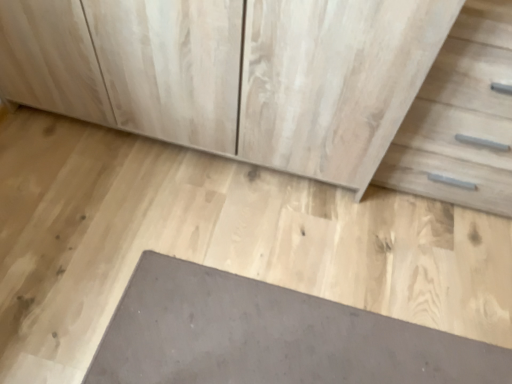
What do you see at coordinates (270, 336) in the screenshot?
I see `slate at lower center` at bounding box center [270, 336].

This screenshot has width=512, height=384. Find the location of `light wood drawer at right`. light wood drawer at right is located at coordinates (461, 117).

Does gray concrete at center have a lesser height compared to light wood drawer at right?

Yes.

Do you think gray concrete at center is within light wood drawer at right, or outside of it?

gray concrete at center exists outside the volume of light wood drawer at right.

Does gray concrete at center appear on the left side of light wood drawer at right?

Correct, you'll find gray concrete at center to the left of light wood drawer at right.

Is light wood drawer at right with slate at lower center?

light wood drawer at right and slate at lower center are not in contact.

Is light wood drawer at right facing towards slate at lower center?

Yes, light wood drawer at right is oriented towards slate at lower center.

Based on the photo, from the image's perspective, who appears lower, light wood drawer at right or slate at lower center?

slate at lower center appears lower in the image.

Is light wood cabinet at center inside slate at lower center?

No, slate at lower center does not contain light wood cabinet at center.

Considering the positions of objects slate at lower center and light wood cabinet at center in the image provided, who is more to the right, slate at lower center or light wood cabinet at center?

From the viewer's perspective, slate at lower center appears more on the right side.

Where is `slate below the light wood cabinet at center (from the image's perspective)`? The image size is (512, 384). slate below the light wood cabinet at center (from the image's perspective) is located at coordinates (270, 336).

From the picture: From a real-world perspective, is slate at lower center beneath light wood cabinet at center?

Yes.

Considering the relative positions of light wood cabinet at center and light wood drawer at right in the image provided, is light wood cabinet at center to the right of light wood drawer at right from the viewer's perspective?

No.

How far apart are light wood cabinet at center and light wood drawer at right?

They are 16.60 inches apart.

Considering the relative sizes of light wood cabinet at center and light wood drawer at right in the image provided, is light wood cabinet at center shorter than light wood drawer at right?

Yes.

From the image's perspective, who appears lower, light wood cabinet at center or light wood drawer at right?

light wood drawer at right.

Considering the relative sizes of gray concrete at center and light wood cabinet at center in the image provided, is gray concrete at center smaller than light wood cabinet at center?

Indeed, gray concrete at center has a smaller size compared to light wood cabinet at center.

Based on the photo, from the image's perspective, is gray concrete at center located above or below light wood cabinet at center?

gray concrete at center is situated lower than light wood cabinet at center in the image.

Is the position of gray concrete at center more distant than that of light wood cabinet at center?

Yes.

Is light wood drawer at right beside light wood cabinet at center?

light wood drawer at right is not next to light wood cabinet at center, and they're not touching.

Does light wood drawer at right turn towards light wood cabinet at center?

No, light wood drawer at right is not oriented towards light wood cabinet at center.

Is light wood drawer at right at the left side of light wood cabinet at center?

No.

From the image's perspective, is light wood drawer at right on top of light wood cabinet at center?

No, from the image's perspective, light wood drawer at right is not above light wood cabinet at center.

Who is taller, light wood drawer at right or gray concrete at center?

light wood drawer at right.

Is light wood drawer at right bigger than gray concrete at center?

Yes.

Would you consider light wood drawer at right to be distant from gray concrete at center?

No, light wood drawer at right is in close proximity to gray concrete at center.

Is light wood drawer at right to the left or to the right of gray concrete at center in the image?

In the image, light wood drawer at right appears on the right side of gray concrete at center.

This screenshot has width=512, height=384. I want to click on concrete below the light wood drawer at right (from the image's perspective), so click(x=216, y=240).

In order to click on slate behind the light wood drawer at right in this screenshot , I will do `click(270, 336)`.

Looking at the image, which one is located further to gray concrete at center, light wood drawer at right or slate at lower center?

The object further to gray concrete at center is light wood drawer at right.

Estimate the real-world distances between objects in this image. Which object is closer to light wood cabinet at center, light wood drawer at right or slate at lower center?

light wood drawer at right is positioned closer to the anchor light wood cabinet at center.

Consider the image. Estimate the real-world distances between objects in this image. Which object is further from light wood cabinet at center, slate at lower center or light wood drawer at right?

slate at lower center is positioned further to the anchor light wood cabinet at center.

Considering their positions, is light wood drawer at right positioned closer to light wood cabinet at center than gray concrete at center?

gray concrete at center.

Based on their spatial positions, is light wood cabinet at center or slate at lower center closer to light wood drawer at right?

The object closer to light wood drawer at right is light wood cabinet at center.

Based on their spatial positions, is slate at lower center or gray concrete at center closer to light wood drawer at right?

gray concrete at center lies closer to light wood drawer at right than the other object.

Estimate the real-world distances between objects in this image. Which object is further from gray concrete at center, slate at lower center or light wood cabinet at center?

Among the two, light wood cabinet at center is located further to gray concrete at center.

Based on their spatial positions, is light wood cabinet at center or gray concrete at center further from light wood drawer at right?

gray concrete at center lies further to light wood drawer at right than the other object.

This screenshot has height=384, width=512. I want to click on concrete between light wood cabinet at center and slate at lower center in the vertical direction, so click(x=216, y=240).

Image resolution: width=512 pixels, height=384 pixels. Find the location of `concrete between light wood cabinet at center and light wood drawer at right in the horizontal direction`. concrete between light wood cabinet at center and light wood drawer at right in the horizontal direction is located at coordinates (216, 240).

Where is `slate between gray concrete at center and light wood drawer at right from left to right`? slate between gray concrete at center and light wood drawer at right from left to right is located at coordinates (270, 336).

Where is `drawer between light wood cabinet at center and slate at lower center from top to bottom`? drawer between light wood cabinet at center and slate at lower center from top to bottom is located at coordinates (461, 117).